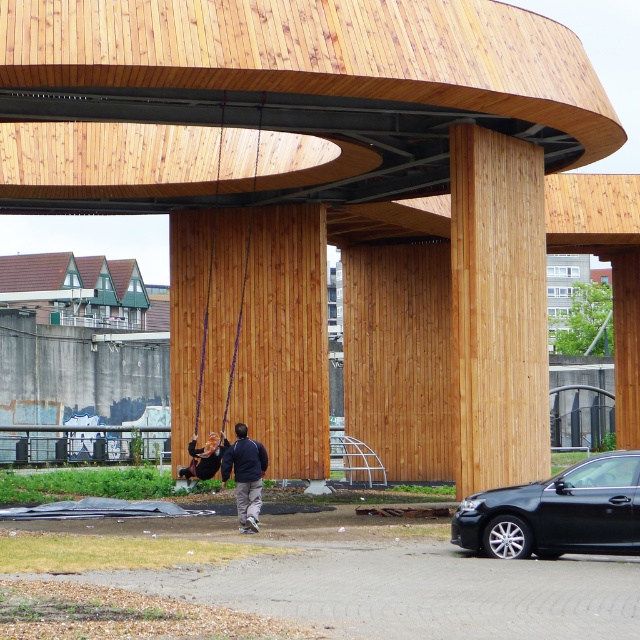
Which is above, purple fabric swing at center or dark blue jacket at center?

Positioned higher is purple fabric swing at center.

Is point (212, 220) closer to camera compared to point (225, 481)?

No.

At what (x,y) coordinates should I click in order to perform the action: click on purple fabric swing at center. Please return your answer as a coordinate pair (x, y). The height and width of the screenshot is (640, 640). Looking at the image, I should click on (227, 385).

From the picture: Is dark blue jacket at center shorter than matte black swing at lower left?

Correct, dark blue jacket at center is not as tall as matte black swing at lower left.

Is dark blue jacket at center to the left of matte black swing at lower left from the viewer's perspective?

No, dark blue jacket at center is not to the left of matte black swing at lower left.

Is point (250, 444) more distant than point (218, 465)?

No, (250, 444) is closer to viewer.

Find the location of a particular element. dark blue jacket at center is located at coordinates (244, 476).

Can you confirm if black metallic car at lower right is wider than dark blue jacket at center?

Correct, the width of black metallic car at lower right exceeds that of dark blue jacket at center.

Does point (566, 540) come farther from viewer compared to point (253, 528)?

No.

In order to click on black metallic car at lower right in this screenshot , I will do click(557, 513).